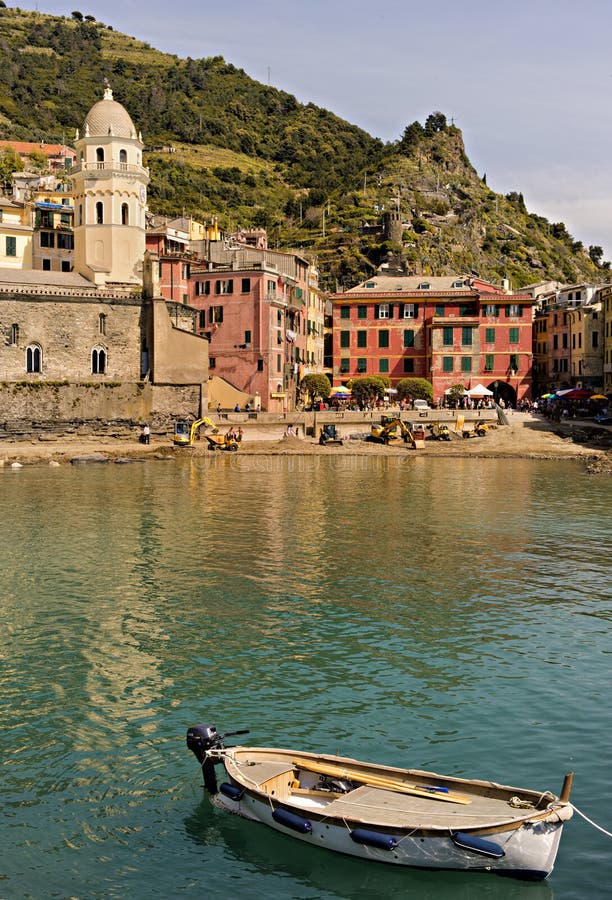
Image resolution: width=612 pixels, height=900 pixels. In order to click on window in this screenshot , I will do `click(407, 333)`.